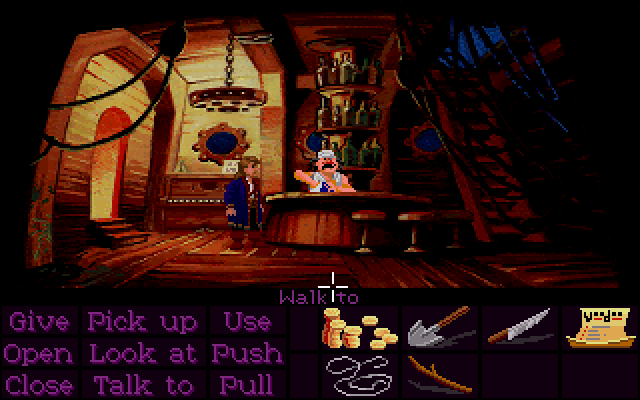
Locate an element on the screen. upright piano is located at coordinates (204, 198).